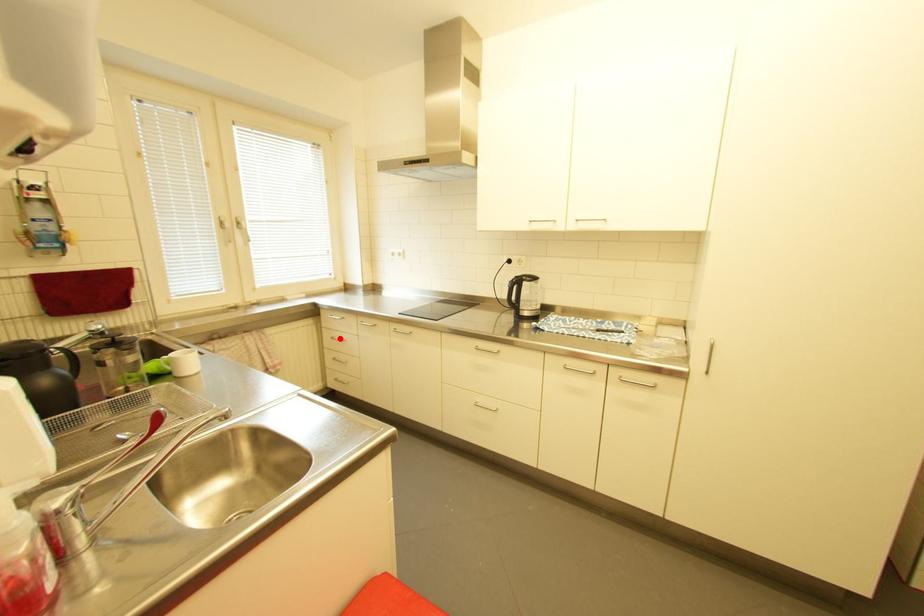
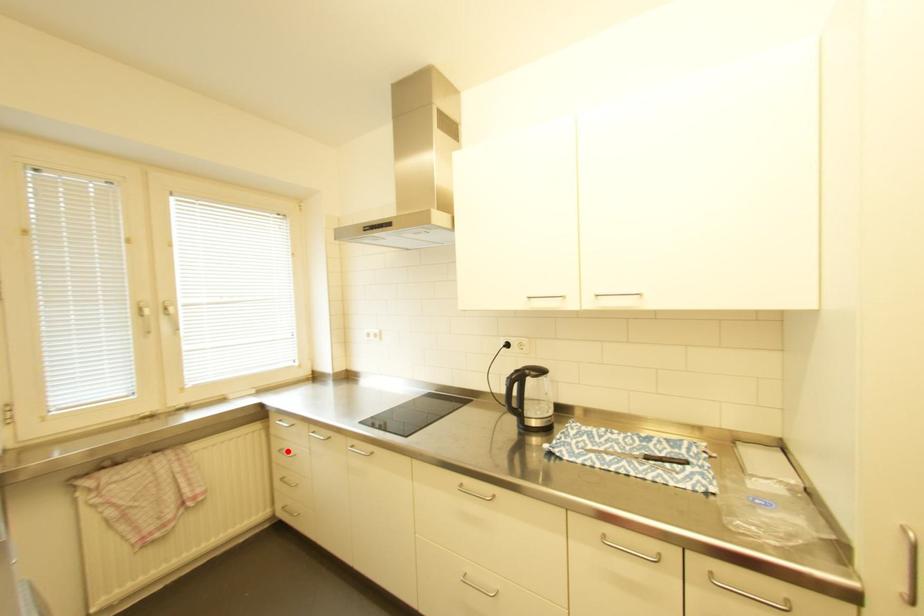
I am providing you with two images of the same scene from different viewpoints. A red point is marked on the first image and another point is marked on the second image. Is the marked point in image1 the same physical position as the marked point in image2?

Yes